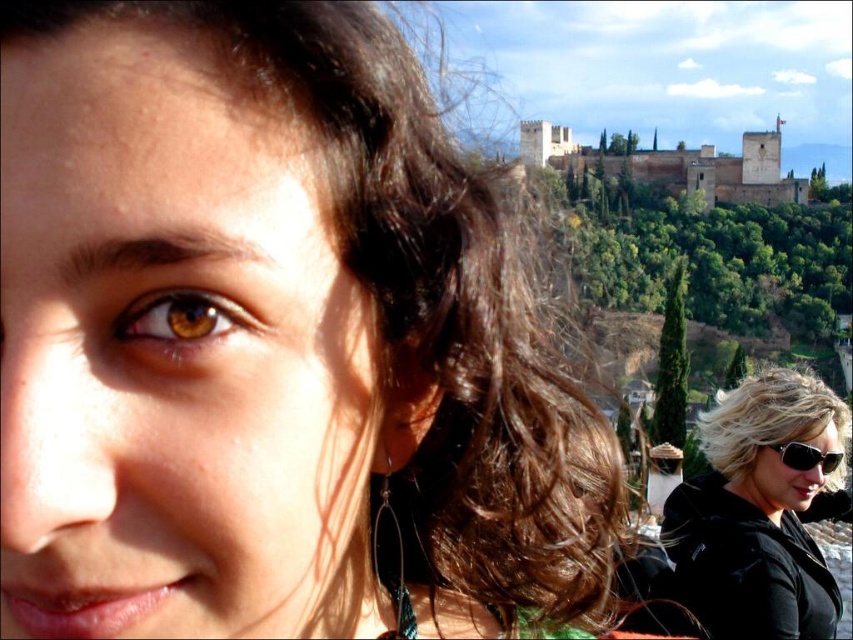
You are a photographer adjusting your camera settings. You notice the black matte sunglasses at lower right and the brown glossy eye at center in your frame. Which object appears wider in the image?

The black matte sunglasses at lower right appears wider than the brown glossy eye at center because its width surpasses the eye.

You are an artist trying to sketch the scene. The brown glossy eye at center is crucial for capturing the subject. Where exactly should you place this eye in your drawing to maintain accuracy?

The brown glossy eye at center should be placed at the 2D coordinates point (183,321) to maintain accuracy.

You are a photographer adjusting your camera settings to capture the scene. You notice the black matte sunglasses at lower right and the brown glossy eye at center. Which object is positioned more to the right side of the frame?

The black matte sunglasses at lower right is positioned more to the right side of the frame compared to the brown glossy eye at center.